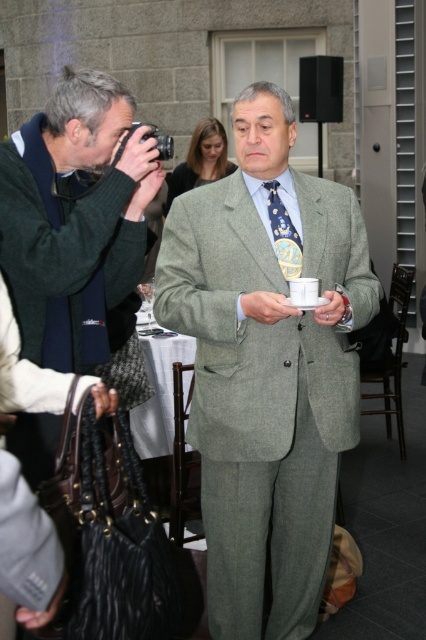
Which is more to the left, green wool suit at center or blue dotted tie at center?

green wool suit at center

Which is behind, point (213, 381) or point (270, 204)?

The point (270, 204) is more distant.

You are a GUI agent. You are given a task and a screenshot of the screen. Output one action in this format:
    pyautogui.click(x=<x>, y=<y>)
    Task: Click on the green wool suit at center
    
    Given the screenshot: What is the action you would take?
    pyautogui.click(x=267, y=369)

Does green wool suit at center appear over matte black camera at left?

No, green wool suit at center is not above matte black camera at left.

Does green wool suit at center appear on the right side of matte black camera at left?

Correct, you'll find green wool suit at center to the right of matte black camera at left.

Does point (325, 259) come in front of point (92, 269)?

No, it is behind (92, 269).

At what (x,y) coordinates should I click in order to perform the action: click on green wool suit at center. Please return your answer as a coordinate pair (x, y). Looking at the image, I should click on click(x=267, y=369).

Between point (55, 150) and point (282, 241), which one is positioned behind?

The point (282, 241) is more distant.

Locate an element on the screen. The width and height of the screenshot is (426, 640). matte black camera at left is located at coordinates (74, 218).